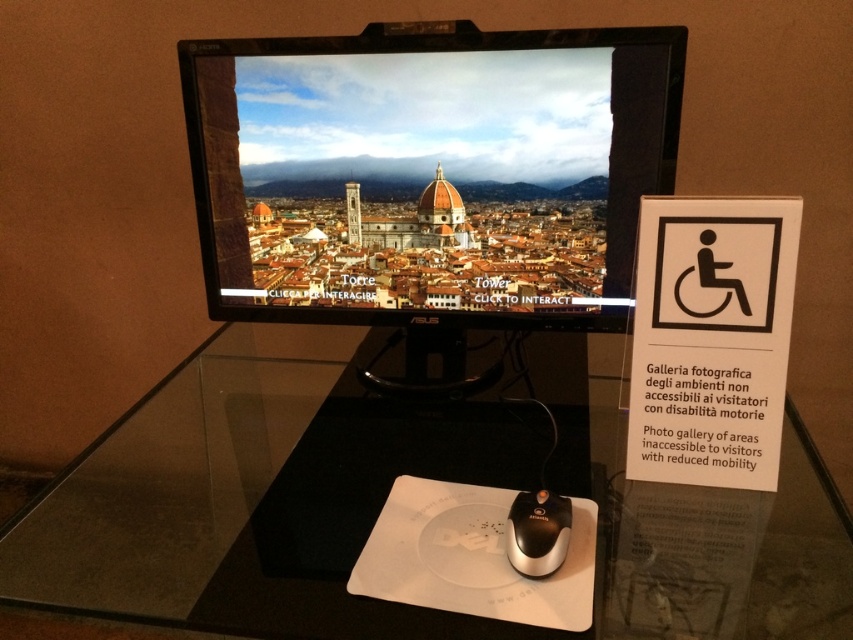
Question: Is transparent glass table at center positioned behind white matte mouse pad at lower center?

Choices:
 (A) yes
 (B) no

Answer: (B)

Question: Which point appears closest to the camera in this image?

Choices:
 (A) (100, 449)
 (B) (701, 220)
 (C) (387, 579)
 (D) (561, 518)

Answer: (C)

Question: Which of the following is the closest to the observer?

Choices:
 (A) (434, 532)
 (B) (532, 515)
 (C) (697, 275)
 (D) (495, 83)

Answer: (B)

Question: Considering the relative positions of transparent glass table at center and white matte mouse pad at lower center in the image provided, where is transparent glass table at center located with respect to white matte mouse pad at lower center?

Choices:
 (A) below
 (B) above

Answer: (B)

Question: Does black glossy monitor at center have a smaller size compared to black plastic mouse at lower center?

Choices:
 (A) yes
 (B) no

Answer: (B)

Question: Based on their relative distances, which object is farther from the white matte mouse pad at lower center?

Choices:
 (A) transparent glass table at center
 (B) black glossy monitor at center
 (C) white paper at right

Answer: (B)